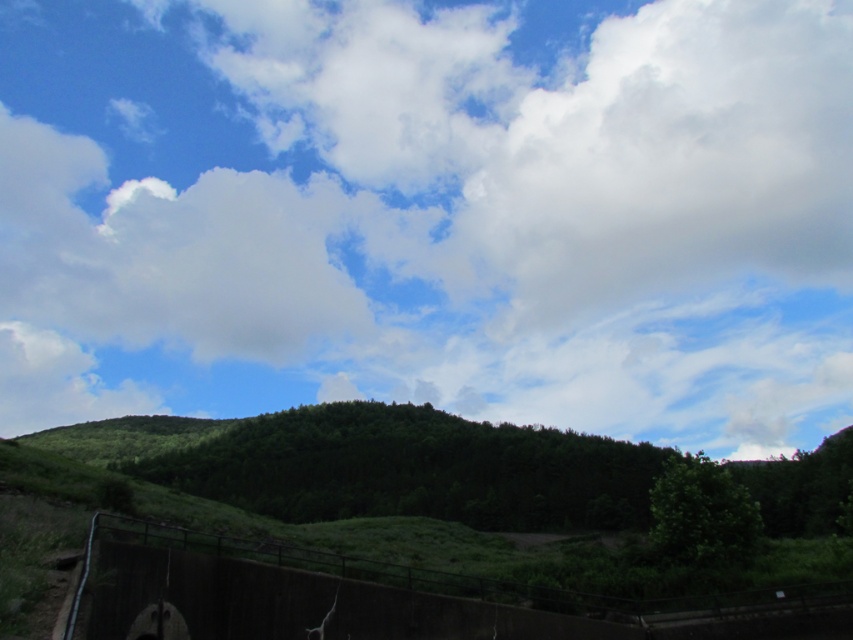
Can you confirm if white fluffy cloud at upper center is smaller than metallic gray fence at lower left?

No.

Locate an element on the screen. Image resolution: width=853 pixels, height=640 pixels. white fluffy cloud at upper center is located at coordinates (431, 212).